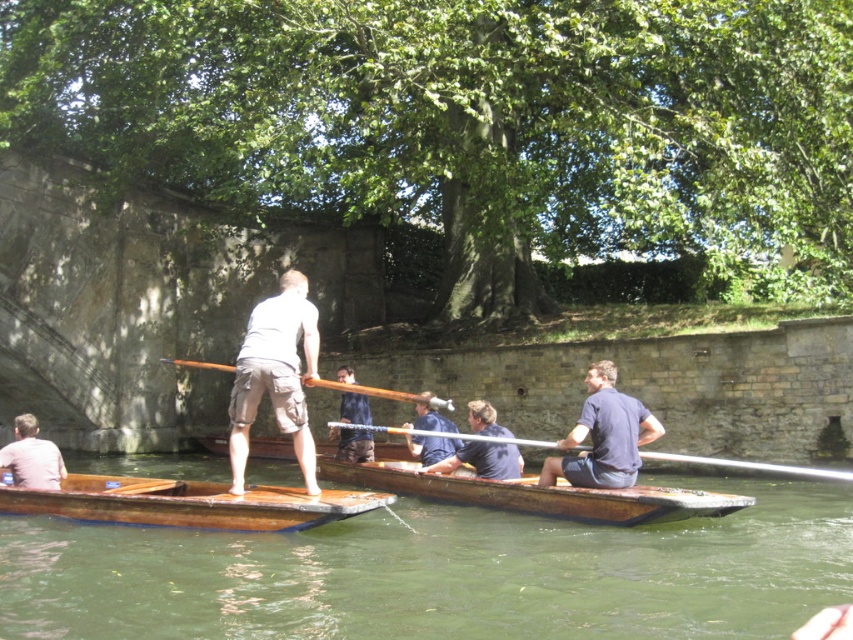
Which is in front, point (36, 484) or point (222, 364)?

Point (36, 484) is more forward.

Who is shorter, light brown leather jacket at lower left or wooden at center?

wooden at center

Is point (33, 417) positioned in front of point (432, 403)?

That is False.

This screenshot has width=853, height=640. Identify the location of light brown leather jacket at lower left. (32, 456).

This screenshot has height=640, width=853. What do you see at coordinates (32, 456) in the screenshot?
I see `light brown leather jacket at lower left` at bounding box center [32, 456].

This screenshot has height=640, width=853. I want to click on light brown leather jacket at lower left, so click(x=32, y=456).

Can you confirm if khaki cargo shorts at center is wider than dark blue fabric at center?

Yes.

Which of these two, khaki cargo shorts at center or dark blue fabric at center, stands taller?

khaki cargo shorts at center

Where is `khaki cargo shorts at center`? The height and width of the screenshot is (640, 853). khaki cargo shorts at center is located at coordinates (x=276, y=376).